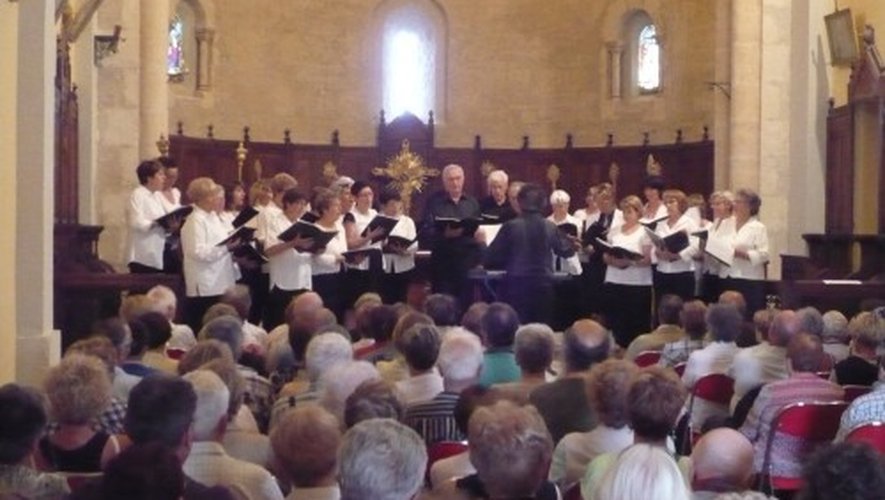
At what (x,y) coordinates should I click in order to perform the action: click on rear wall of the church. Please return your answer as a coordinate pair (x, y). This screenshot has width=885, height=500. Looking at the image, I should click on (499, 20).